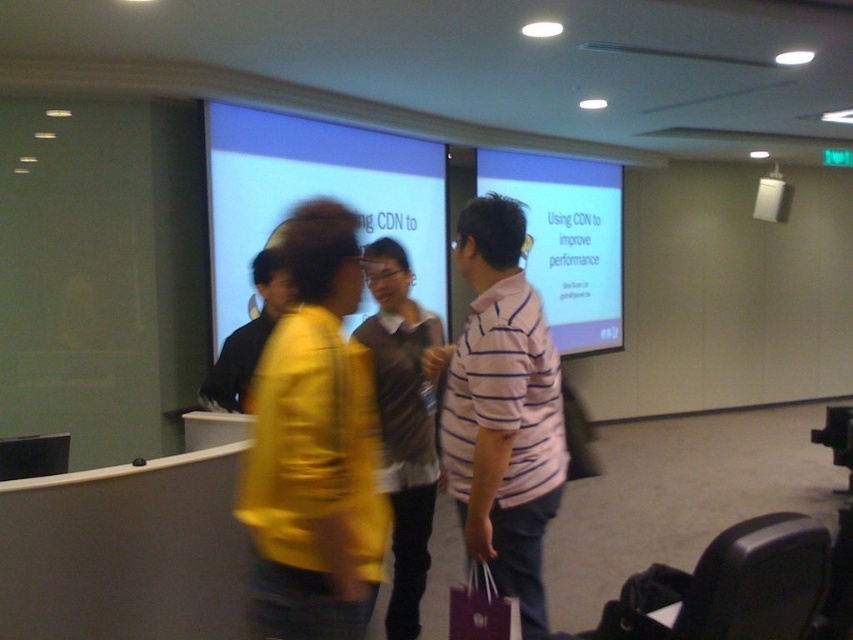
Question: Is matte yellow jacket at center wider than pink striped shirt at center?

Choices:
 (A) no
 (B) yes

Answer: (A)

Question: In this image, where is matte yellow jacket at center located relative to matte purple shopping bag at lower center?

Choices:
 (A) right
 (B) left

Answer: (B)

Question: Is white matte projection screen at center wider than matte purple shopping bag at lower center?

Choices:
 (A) no
 (B) yes

Answer: (B)

Question: Based on their relative distances, which object is farther from the matte purple shopping bag at lower center?

Choices:
 (A) knitted sweater at center
 (B) matte yellow jacket at center
 (C) white matte projection screen at center

Answer: (C)

Question: Among these points, which one is nearest to the camera?

Choices:
 (A) (265, 257)
 (B) (338, 272)
 (C) (440, 144)

Answer: (B)

Question: Which point is closer to the camera taking this photo?

Choices:
 (A) (387, 276)
 (B) (468, 566)

Answer: (B)